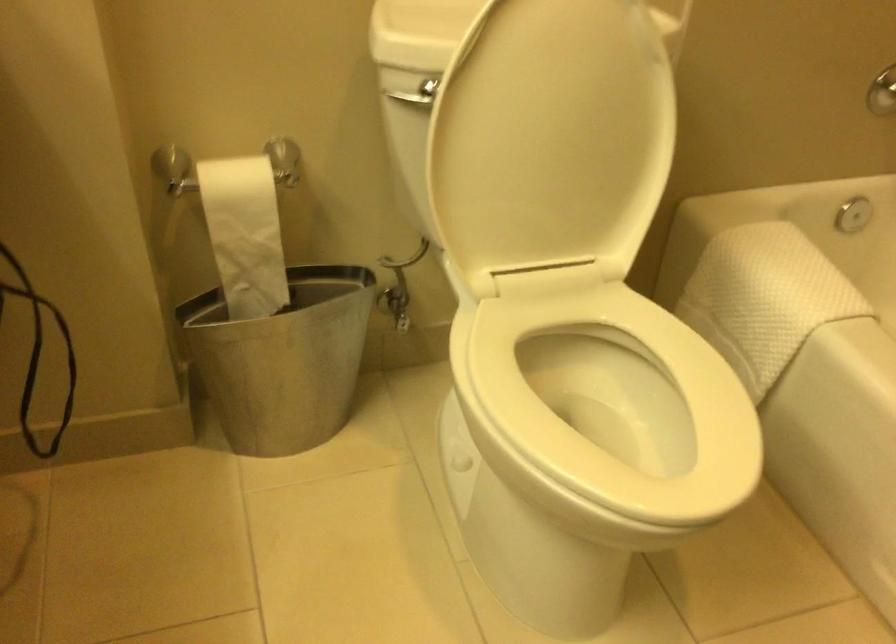
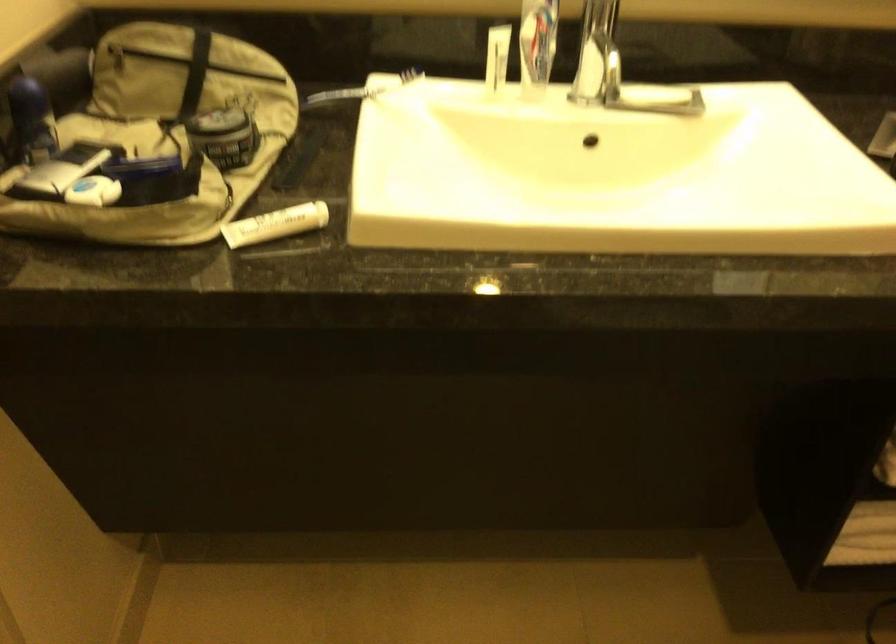
First-person continuous shooting, in which direction is the camera rotating?

The camera rotated toward left-down.